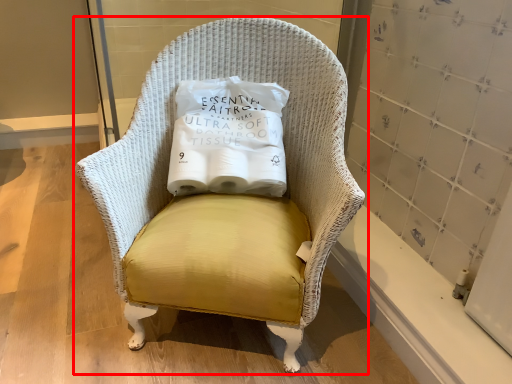
Question: Observing the image, what is the correct spatial positioning of chair (annotated by the red box) in reference to pillow?

Choices:
 (A) right
 (B) left

Answer: (A)